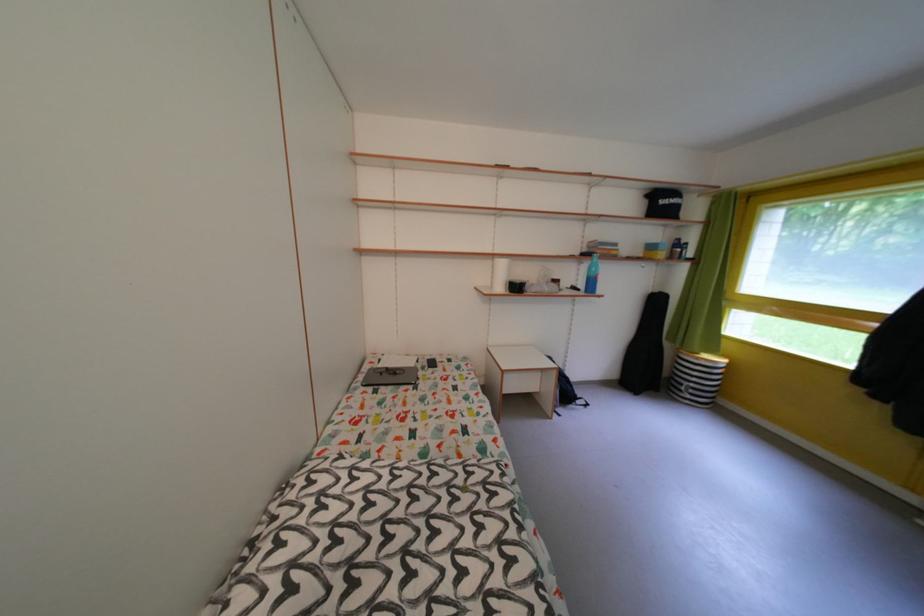
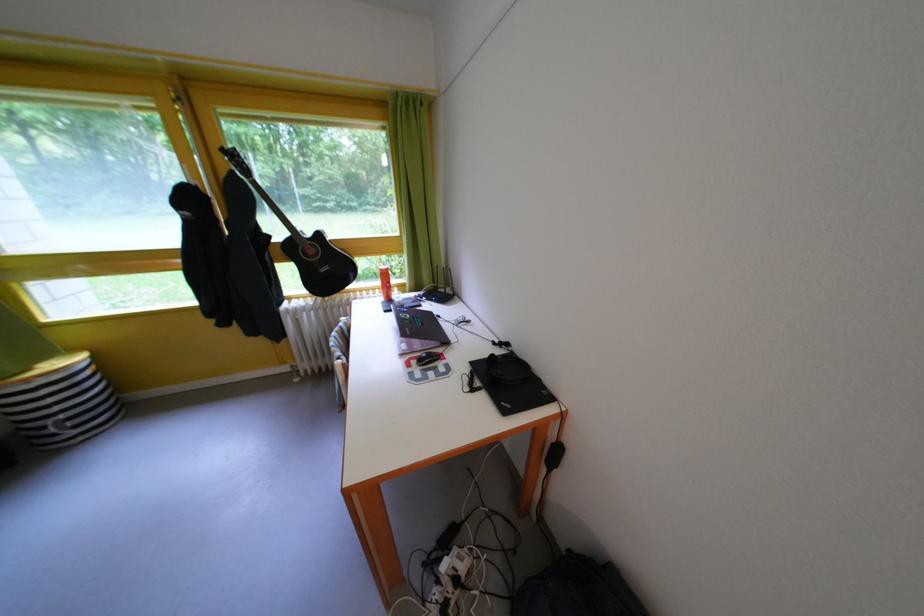
The first image is from the beginning of the video and the second image is from the end. How did the camera likely rotate when shooting the video?

The camera rotated toward right-down.